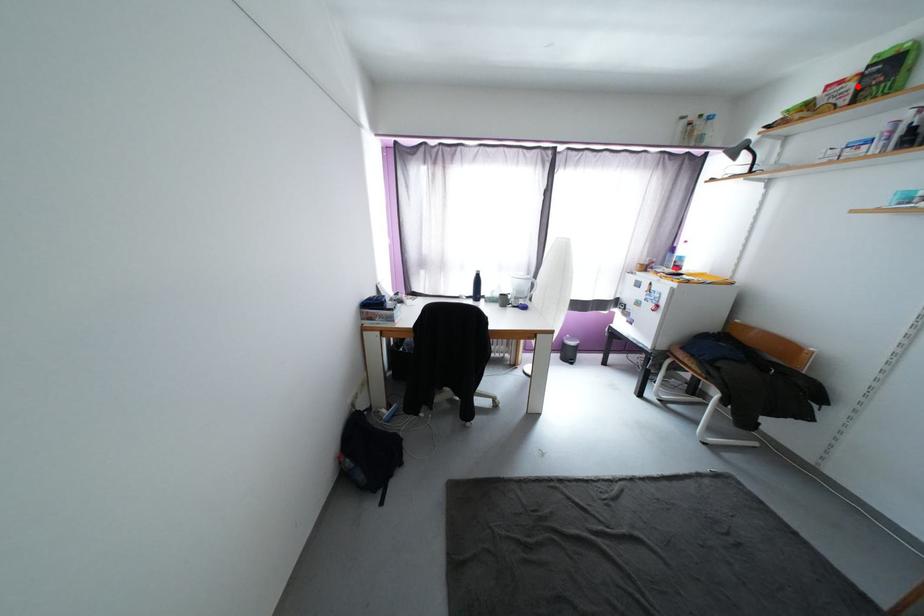
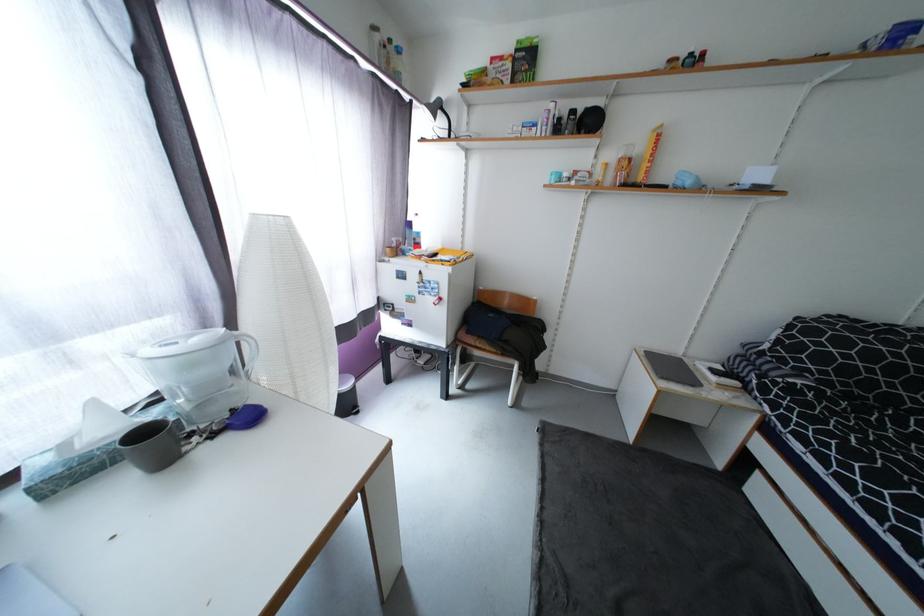
Find the pixel in the second image that matches the highlighted location in the first image.

(515, 66)